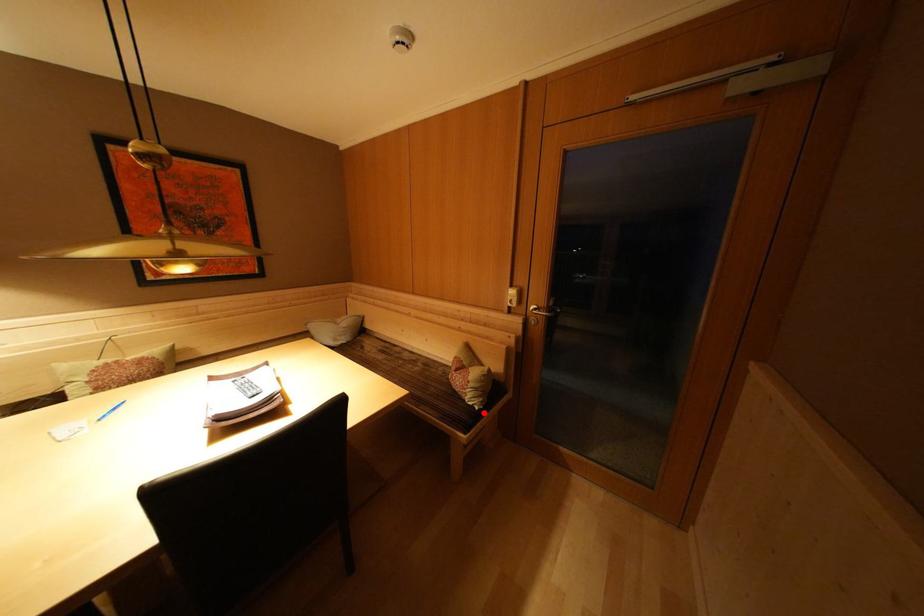
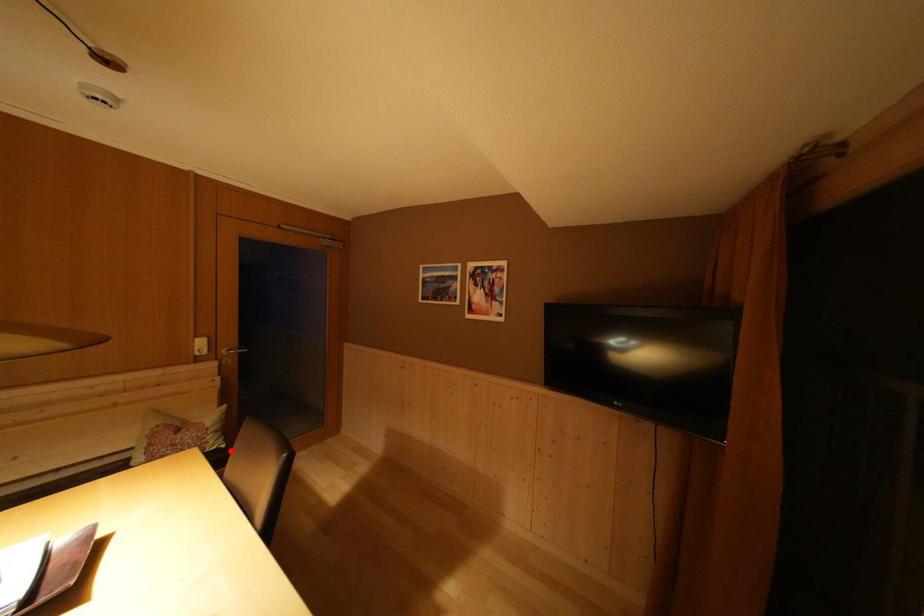
I am providing you with two images of the same scene from different viewpoints. A red point is marked on the first image and another point is marked on the second image. Do the highlighted points in image1 and image2 indicate the same real-world spot?

Yes